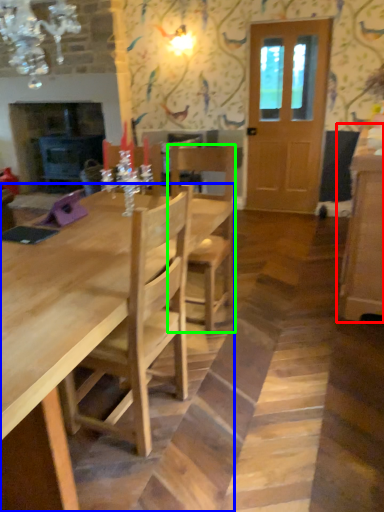
Question: Estimate the real-world distances between objects in this image. Which object is closer to cabinetry (highlighted by a red box), kitchen & dining room table (highlighted by a blue box) or chair (highlighted by a green box)?

Choices:
 (A) kitchen & dining room table
 (B) chair

Answer: (B)